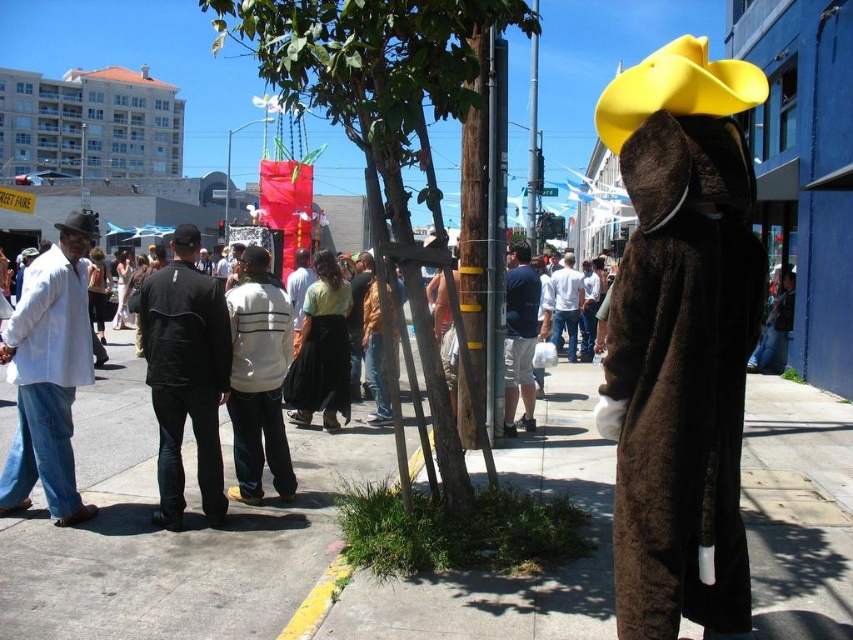
Question: Can you confirm if brown fuzzy coat at right is positioned to the left of blue cotton shirt at center?

Choices:
 (A) no
 (B) yes

Answer: (A)

Question: Which is farther from the brown fuzzy coat at right?

Choices:
 (A) white cotton shirt at left
 (B) matte black cowboy hat at left
 (C) white cotton shirt at center

Answer: (C)

Question: Can you confirm if green leafy tree at center is bigger than white striped sweater at center?

Choices:
 (A) no
 (B) yes

Answer: (B)

Question: Which of the following is the closest to the observer?

Choices:
 (A) (38, 472)
 (B) (416, 92)
 (C) (234, 429)

Answer: (B)

Question: Can you confirm if gray concrete sidewalk at center is thinner than white cotton shirt at left?

Choices:
 (A) no
 (B) yes

Answer: (A)

Question: Which point is closer to the camera?

Choices:
 (A) (33, 438)
 (B) (189, 275)
 (C) (653, 392)
 (D) (611, 481)

Answer: (C)